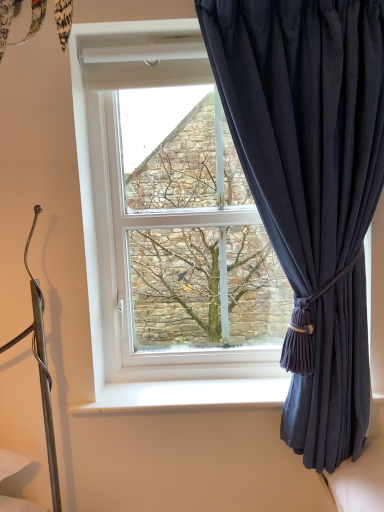
Question: From their relative heights in the image, would you say green textured tree at center is taller or shorter than white plastic window sill at lower center?

Choices:
 (A) tall
 (B) short

Answer: (A)

Question: Is green textured tree at center in front of or behind white plastic window sill at lower center in the image?

Choices:
 (A) behind
 (B) front

Answer: (B)

Question: Which object is the farthest from the green textured tree at center?

Choices:
 (A) white plastic window sill at lower center
 (B) dark blue fabric curtain at right

Answer: (A)

Question: Which of these objects is positioned closest to the white plastic window sill at lower center?

Choices:
 (A) dark blue fabric curtain at right
 (B) green textured tree at center

Answer: (B)